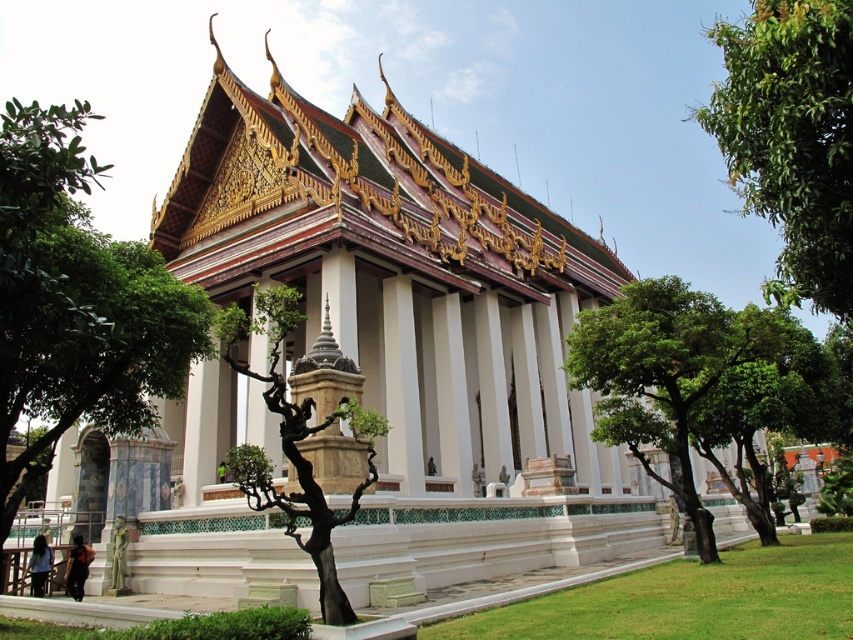
Can you confirm if green leafy tree at center is wider than black textured tree at center?

Yes, green leafy tree at center is wider than black textured tree at center.

Can you confirm if green leafy tree at center is positioned above black textured tree at center?

No.

You are a GUI agent. You are given a task and a screenshot of the screen. Output one action in this format:
    pyautogui.click(x=<x>, y=<y>)
    Task: Click on the green leafy tree at center
    
    Given the screenshot: What is the action you would take?
    pyautogui.click(x=659, y=374)

Is the position of green leafy tree at upper right less distant than that of black textured tree at center?

Yes, it is.

From the picture: Between green leafy tree at upper right and black textured tree at center, which one appears on the right side from the viewer's perspective?

Positioned to the right is green leafy tree at upper right.

Does point (785, 278) lie in front of point (264, 500)?

No, it is behind (264, 500).

Where is `green leafy tree at upper right`? The width and height of the screenshot is (853, 640). green leafy tree at upper right is located at coordinates (791, 140).

Which of these two, green leafy tree at upper right or green leafy tree at center, stands taller?

With more height is green leafy tree at upper right.

Based on the photo, does green leafy tree at upper right appear on the left side of green leafy tree at center?

Incorrect, green leafy tree at upper right is not on the left side of green leafy tree at center.

Describe the element at coordinates (791, 140) in the screenshot. I see `green leafy tree at upper right` at that location.

What are the coordinates of `green leafy tree at upper right` in the screenshot? It's located at (791, 140).